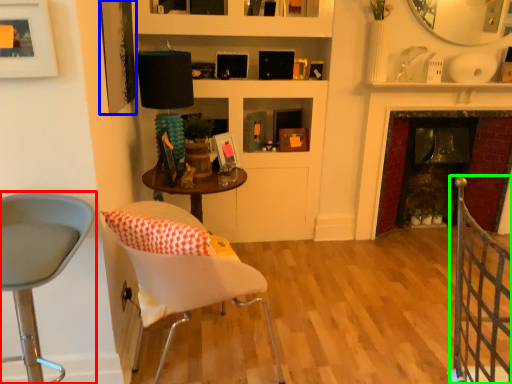
Question: Which object is positioned farthest from chair (highlighted by a red box)? Select from picture frame (highlighted by a blue box) and rail (highlighted by a green box).

Choices:
 (A) picture frame
 (B) rail

Answer: (B)